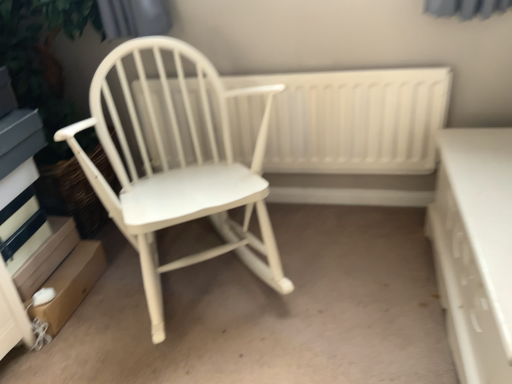
You are a GUI agent. You are given a task and a screenshot of the screen. Output one action in this format:
    pyautogui.click(x=<x>, y=<y>)
    Task: Click on the blank area beneath white wood rocking chair at left (from a real-world perspective)
    The image size is (512, 384).
    Given the screenshot: What is the action you would take?
    pyautogui.click(x=198, y=269)